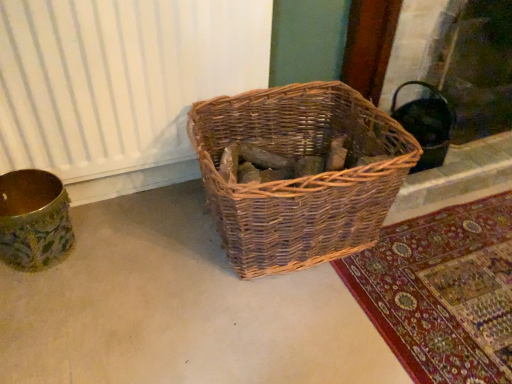
You are a GUI agent. You are given a task and a screenshot of the screen. Output one action in this format:
    pyautogui.click(x=<x>, y=<y>)
    Task: Click on the free area behind gold textured vase at left
    This screenshot has width=512, height=384.
    Given the screenshot: What is the action you would take?
    pyautogui.click(x=96, y=206)